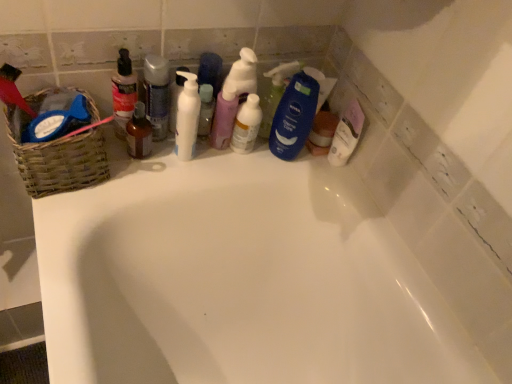
This screenshot has width=512, height=384. Find the location of `free space to the right of blue matte bottle at center, the 4th cleaning product when ordered from left to right`. free space to the right of blue matte bottle at center, the 4th cleaning product when ordered from left to right is located at coordinates (336, 180).